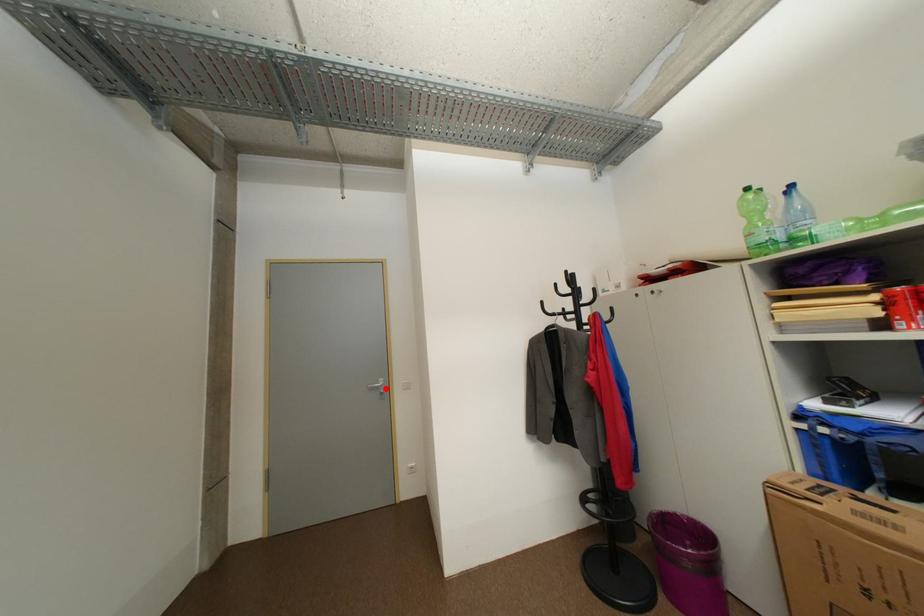
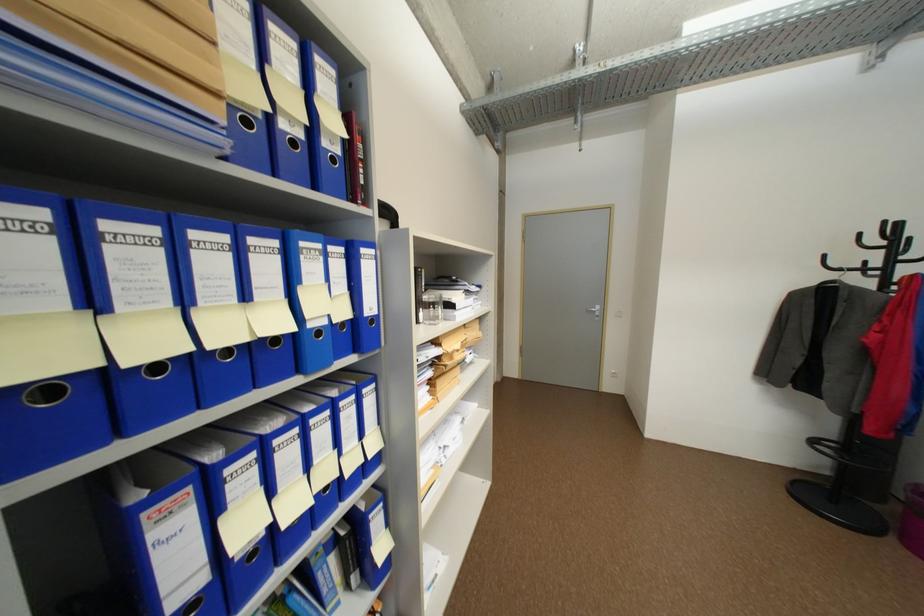
Find the pixel in the second image that matches the highlighted location in the first image.

(602, 313)